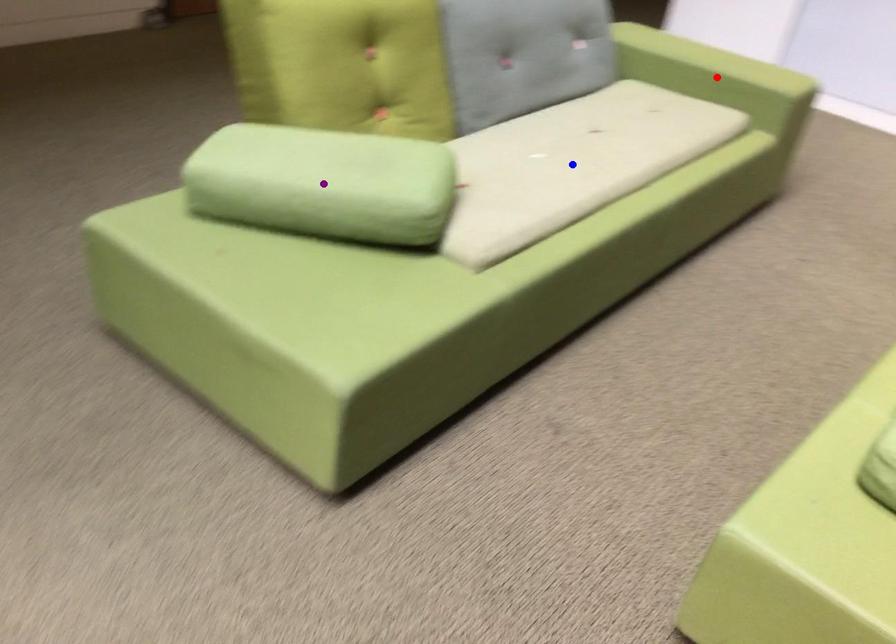
Order these from nearest to farthest:
A) purple point
B) blue point
C) red point

purple point
blue point
red point